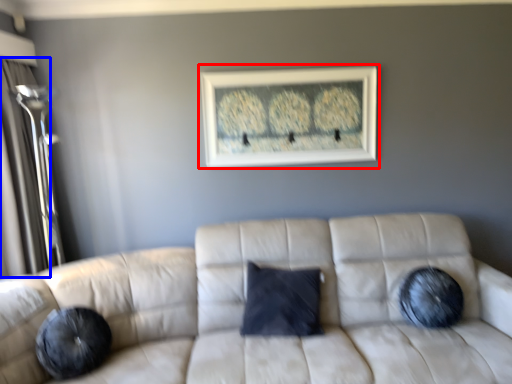
Question: Which object appears farthest to the camera in this image, picture frame (highlighted by a red box) or glass door (highlighted by a blue box)?

Choices:
 (A) picture frame
 (B) glass door

Answer: (A)